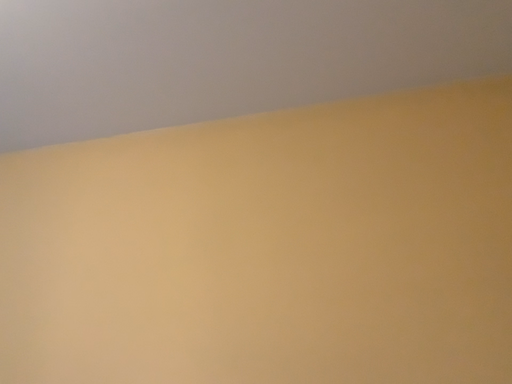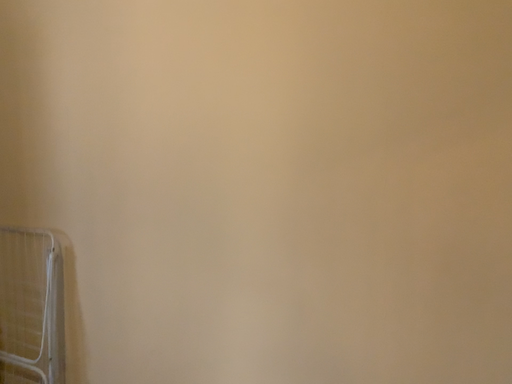
Question: How did the camera likely rotate when shooting the video?

Choices:
 (A) rotated upward
 (B) rotated downward

Answer: (B)